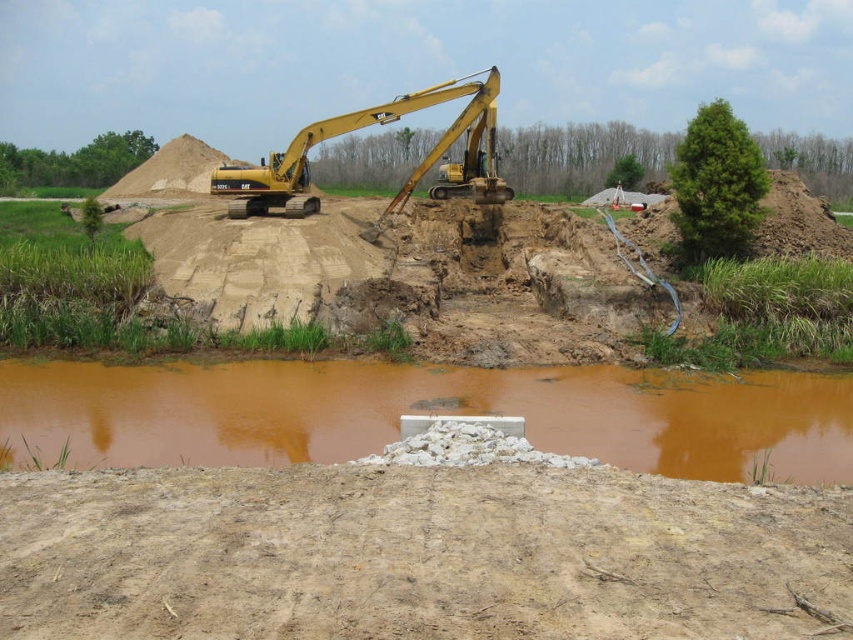
You are a construction worker assessing the site. You need to know which area is wider between the dull brown dirt at lower center and the brown sediment water at center. Which one is wider?

The brown sediment water at center is wider than the dull brown dirt at lower center.

You are an engineer inspecting the construction site. You notice the dull brown dirt at lower center and the yellow metallic excavator at center. Based on their positions, which object is closer to the ground?

The dull brown dirt at lower center is closer to the ground since it is located below the yellow metallic excavator at center.